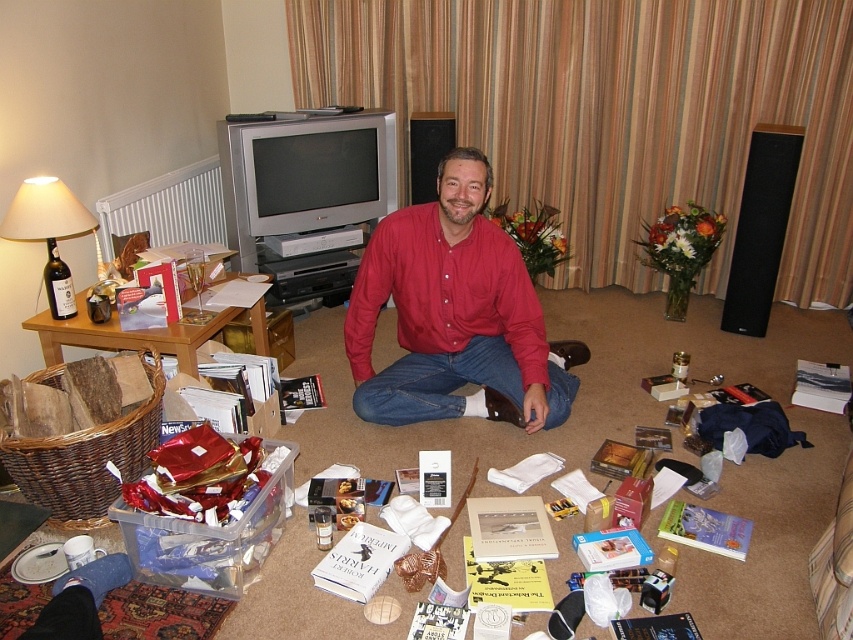
Question: Which of the following is the closest to the observer?

Choices:
 (A) (368, 275)
 (B) (51, 294)

Answer: (B)

Question: Is red cotton shirt at center wider than matte beige lampshade at left?

Choices:
 (A) no
 (B) yes

Answer: (B)

Question: Is the position of red cotton shirt at center less distant than that of matte beige lampshade at left?

Choices:
 (A) no
 (B) yes

Answer: (A)

Question: Which point is closer to the camera?

Choices:
 (A) (55, 307)
 (B) (560, 419)

Answer: (A)

Question: Is red cotton shirt at center below matte beige lampshade at left?

Choices:
 (A) yes
 (B) no

Answer: (A)